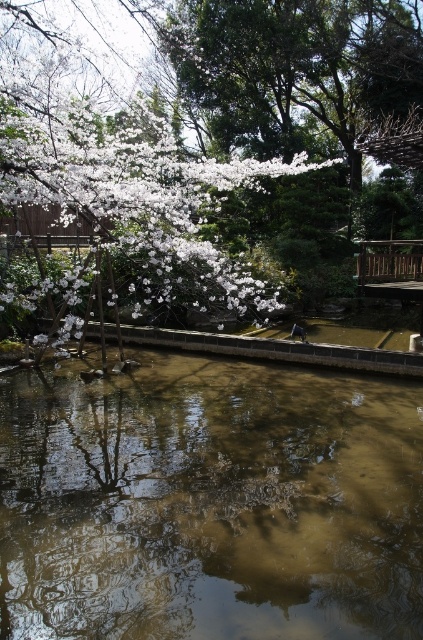
Which of these two, brown reflective water at center or white blossoms at upper left, stands shorter?

brown reflective water at center is shorter.

Where is `brown reflective water at center`? brown reflective water at center is located at coordinates [209, 502].

Locate an element on the screen. brown reflective water at center is located at coordinates (209, 502).